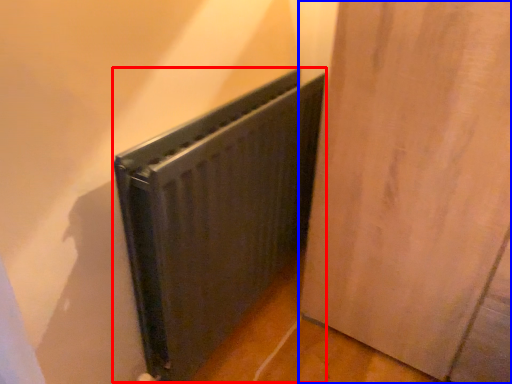
Question: Which object appears farthest to the camera in this image, radiator (highlighted by a red box) or door (highlighted by a blue box)?

Choices:
 (A) radiator
 (B) door

Answer: (A)